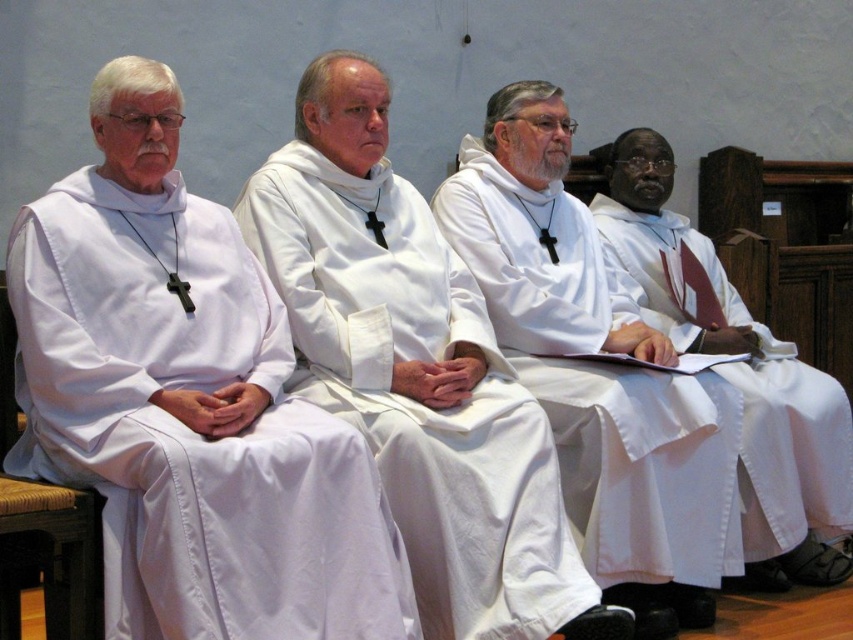
You are a photographer positioned in front of the four individuals. You need to adjust your camera focus to capture both the white matte robe at center and the white satin robe at right. Which robe should you focus on first to ensure both are in sharp focus?

You should focus on the white matte robe at center first since it is closer to the viewer than the white satin robe at right. By focusing on the closer robe, the depth of field will naturally include the farther robe in acceptable sharpness.

You are an interior designer tasked with placing a decorative item on the floor. The white matte robe at center is located at point 0.580, 0.700. Where should you place the item to ensure it is directly in front of the robe?

The decorative item should be placed directly in front of the white matte robe at center, aligning with its position at point (596, 371) on the floor.